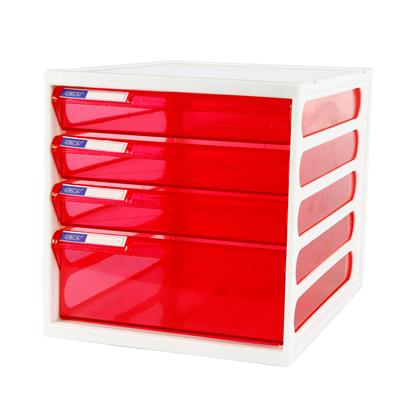
You are a GUI agent. You are given a task and a screenshot of the screen. Output one action in this format:
    pyautogui.click(x=<x>, y=<y>)
    Task: Click on the translucent view thru red drawers
    Image resolution: width=400 pixels, height=400 pixels.
    Given the screenshot: What is the action you would take?
    pyautogui.click(x=99, y=275), pyautogui.click(x=87, y=208), pyautogui.click(x=122, y=169), pyautogui.click(x=89, y=160)